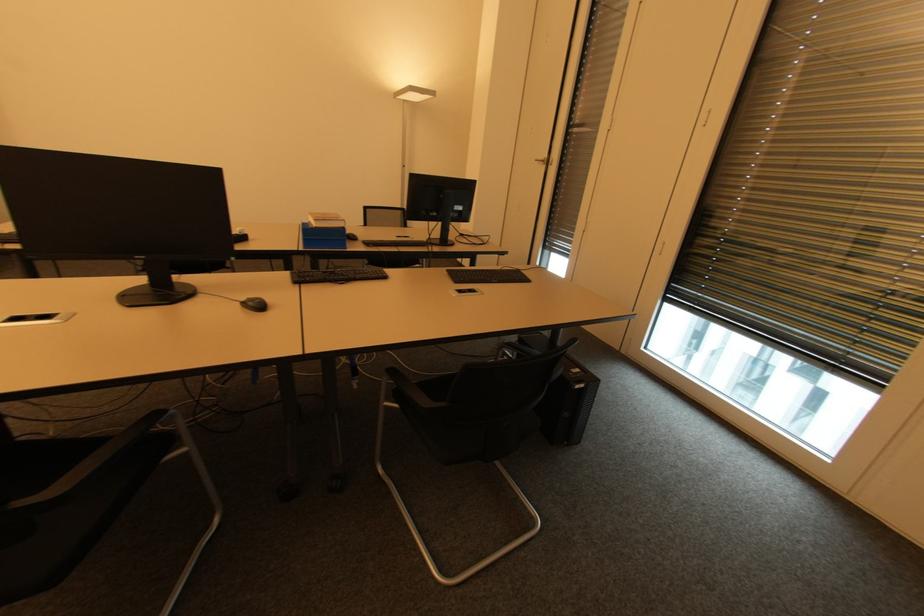
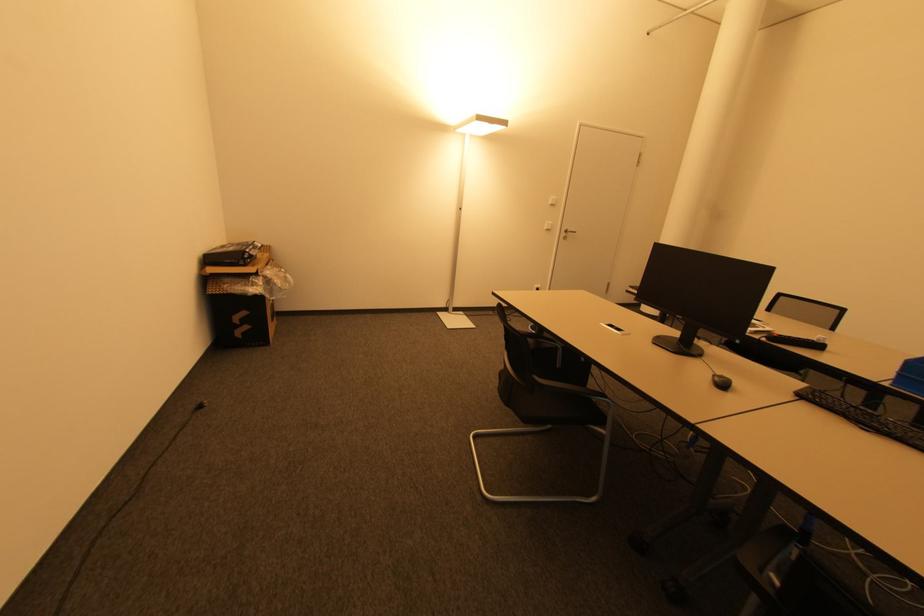
Where in the second image is the point corresponding to the point at 245,238 from the first image?

(819, 346)